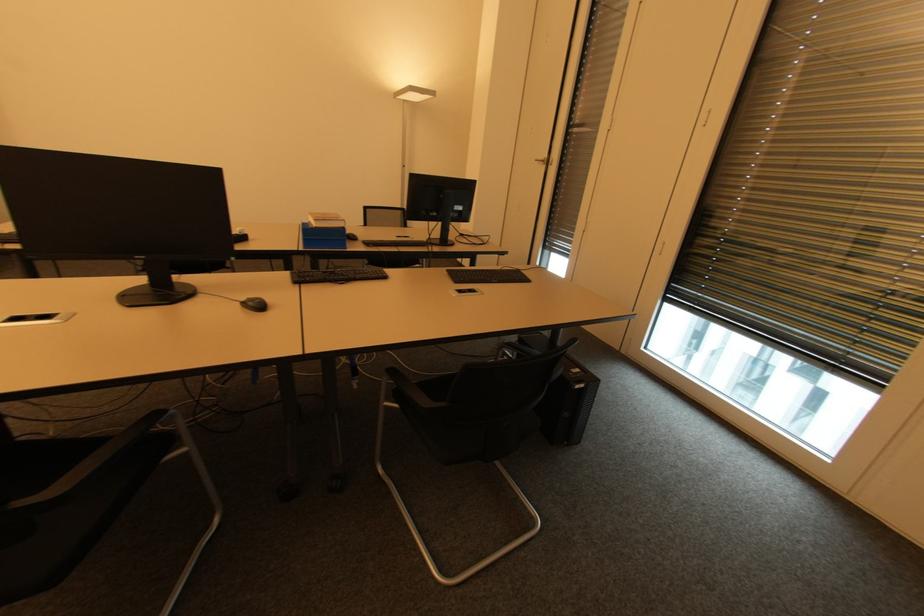
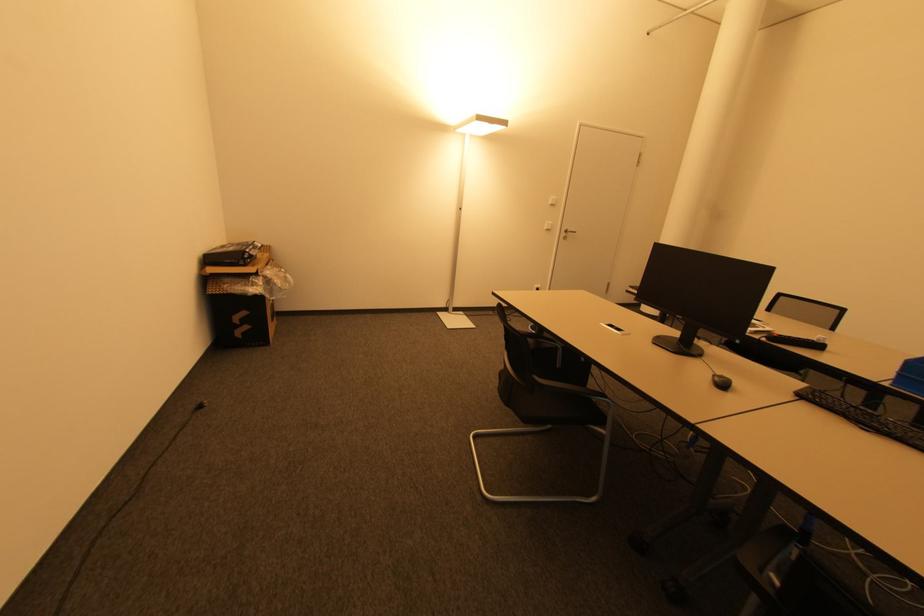
Where in the second image is the point corresponding to the point at 245,238 from the first image?

(819, 346)